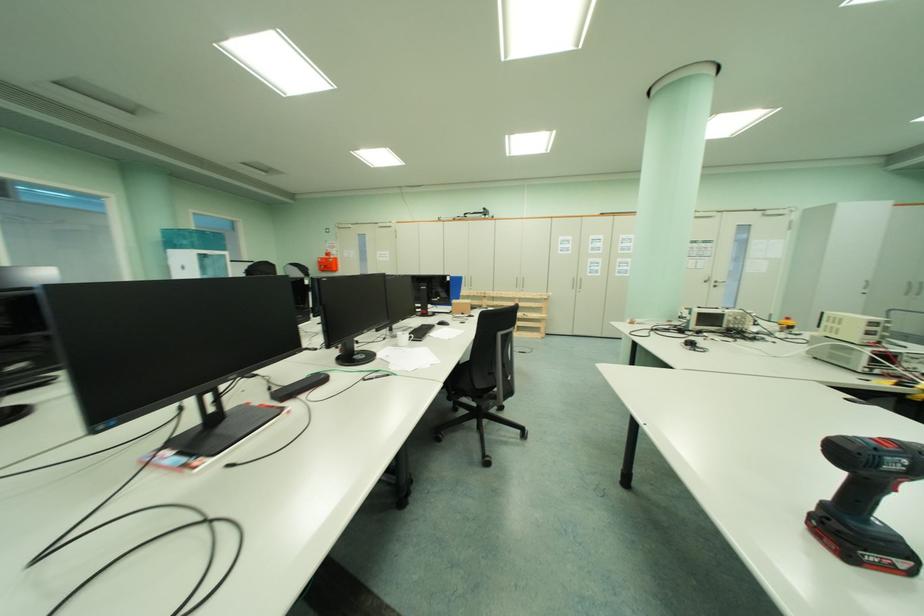
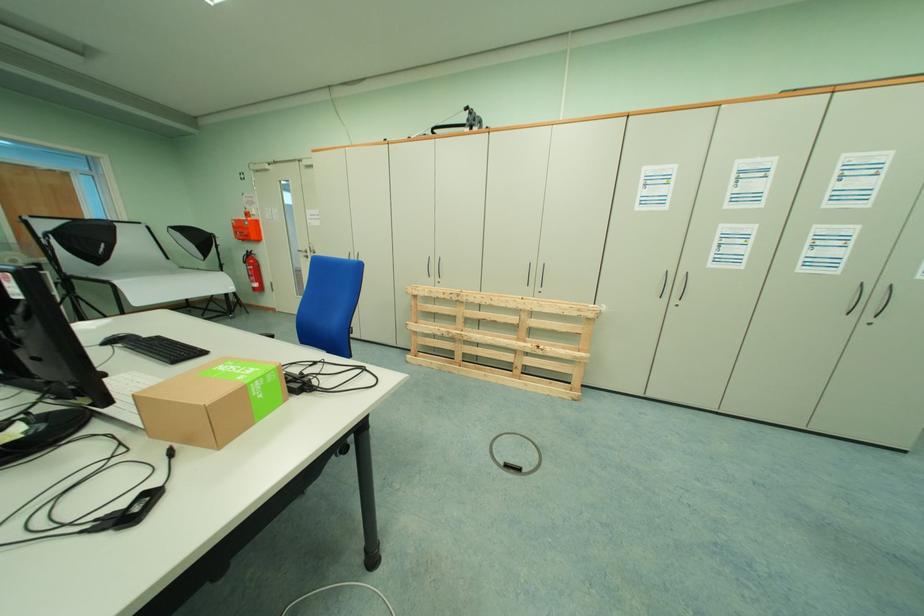
Question: The images are taken continuously from a first-person perspective. In which direction are you moving?

Choices:
 (A) Left
 (B) Right
 (C) Forward
 (D) Backward

Answer: (C)